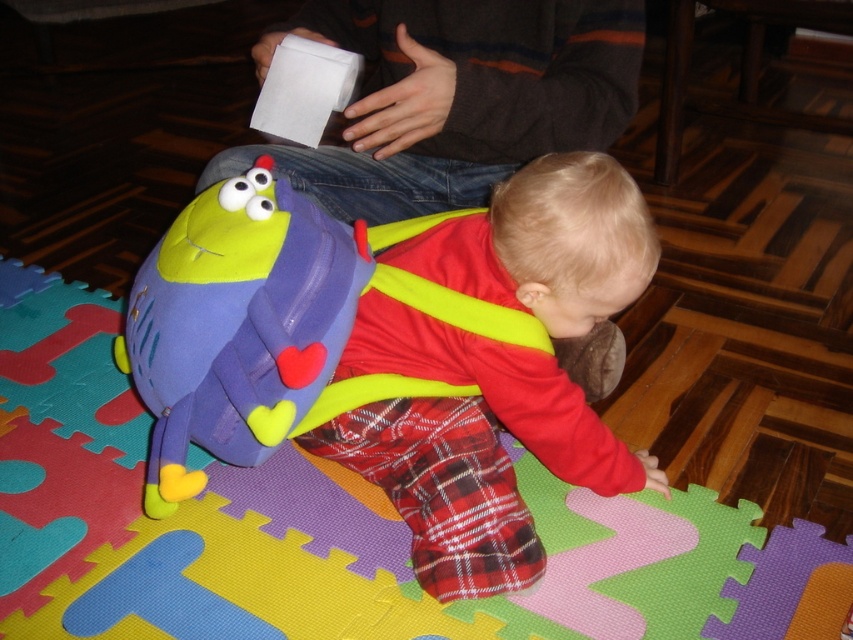
Does point (631, 288) come in front of point (285, 218)?

Yes, point (631, 288) is in front of point (285, 218).

Can you confirm if red plaid pants at center is shorter than matte purple backpack at lower left?

No, red plaid pants at center is not shorter than matte purple backpack at lower left.

The width and height of the screenshot is (853, 640). What do you see at coordinates (468, 445) in the screenshot?
I see `red plaid pants at center` at bounding box center [468, 445].

This screenshot has width=853, height=640. Find the location of `red plaid pants at center`. red plaid pants at center is located at coordinates (468, 445).